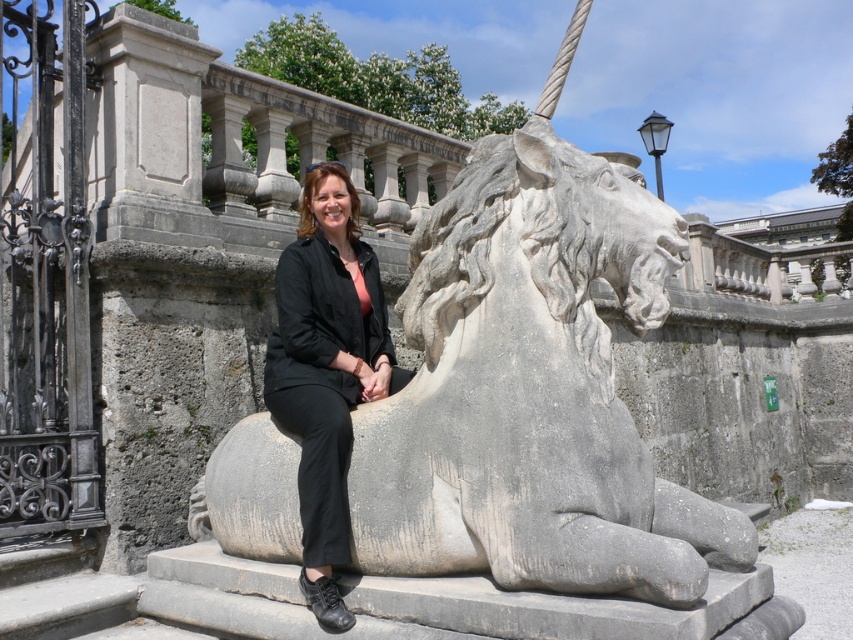
Does gray stone horse at center have a greater height compared to black fabric jacket at center?

In fact, gray stone horse at center may be shorter than black fabric jacket at center.

Is point (370, 532) in front of point (344, 392)?

Yes, point (370, 532) is closer to viewer.

The height and width of the screenshot is (640, 853). What are the coordinates of `gray stone horse at center` in the screenshot? It's located at (531, 392).